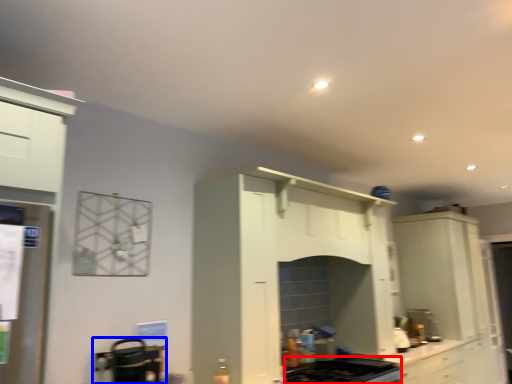
Question: Which point is further to the camera, gas stove (highlighted by a red box) or appliance (highlighted by a blue box)?

Choices:
 (A) gas stove
 (B) appliance

Answer: (A)